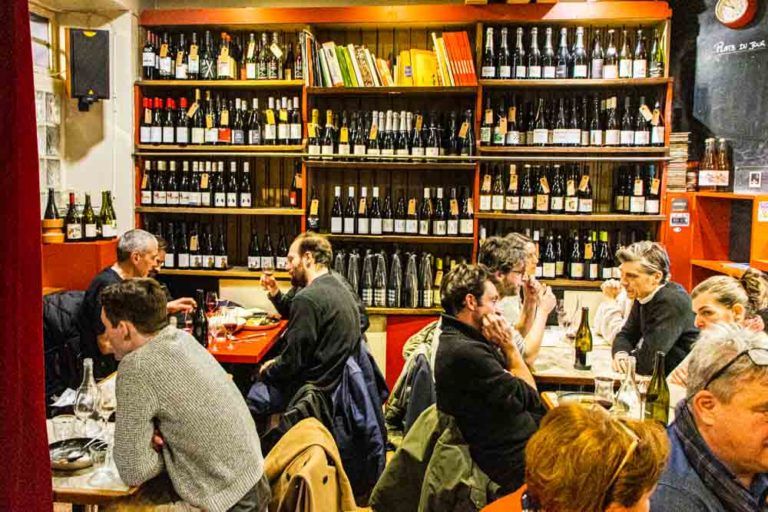
Locate an element on the screen. This screenshot has height=512, width=768. books is located at coordinates (449, 73).